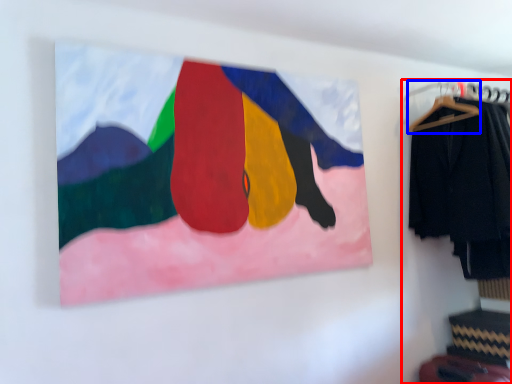
Question: Among these objects, which one is farthest to the camera, closet (highlighted by a red box) or hanger (highlighted by a blue box)?

Choices:
 (A) closet
 (B) hanger

Answer: (B)